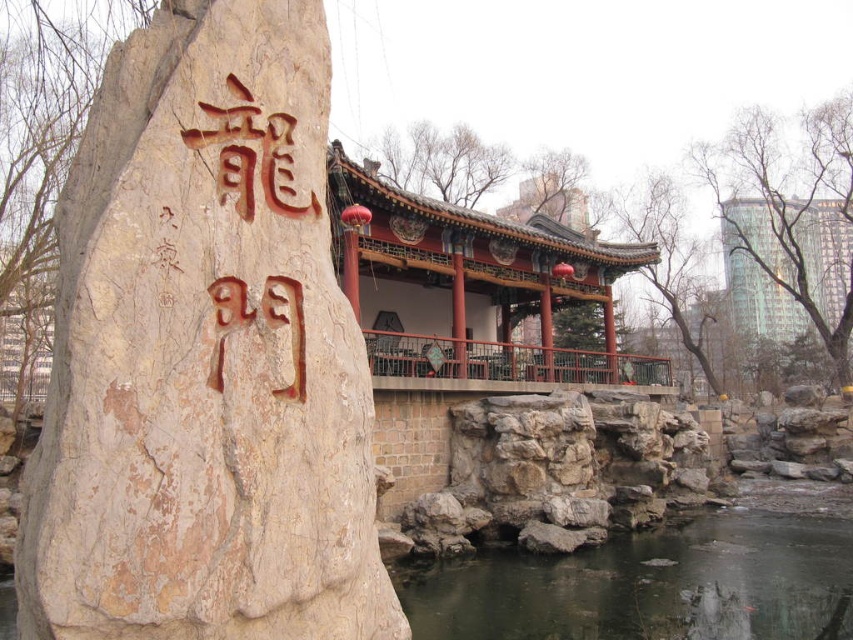
Question: Is clear water at lower center thinner than brown carved stone at left?

Choices:
 (A) yes
 (B) no

Answer: (B)

Question: Which object is closer to the camera taking this photo?

Choices:
 (A) clear water at lower center
 (B) brown carved character at upper center
 (C) brown carved stone at left

Answer: (C)

Question: Which object is the closest to the beige stone boulder at center?

Choices:
 (A) brown carved character at upper center
 (B) clear water at lower center
 (C) brown carved stone at left

Answer: (A)

Question: Does brown carved stone at left have a lesser width compared to brown carved character at upper center?

Choices:
 (A) no
 (B) yes

Answer: (B)

Question: Is brown carved stone at left above brown carved character at upper center?

Choices:
 (A) no
 (B) yes

Answer: (A)

Question: Which object is closer to the camera taking this photo?

Choices:
 (A) clear water at lower center
 (B) beige stone boulder at center

Answer: (B)